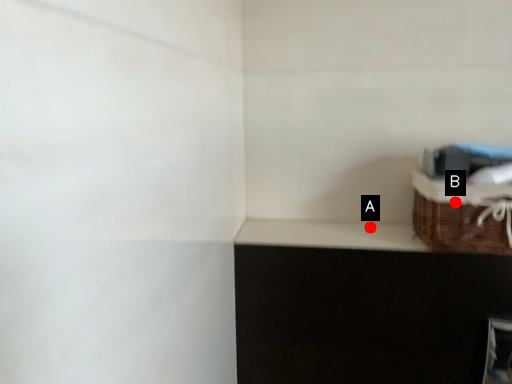
Question: Two points are circled on the image, labeled by A and B beside each circle. Which of the following is the farthest from the observer?

Choices:
 (A) A is further
 (B) B is further

Answer: (A)